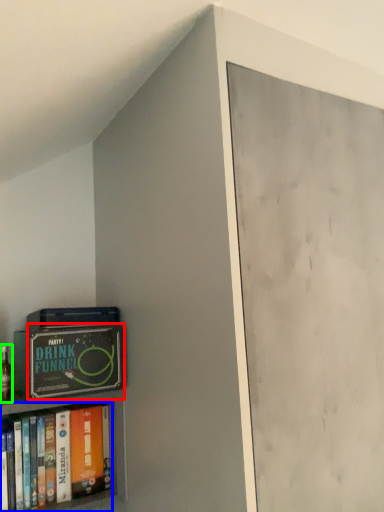
Question: Which object is positioned closest to paperback book (highlighted by a red box)? Select from book (highlighted by a blue box) and alcohol (highlighted by a green box).

Choices:
 (A) book
 (B) alcohol

Answer: (A)